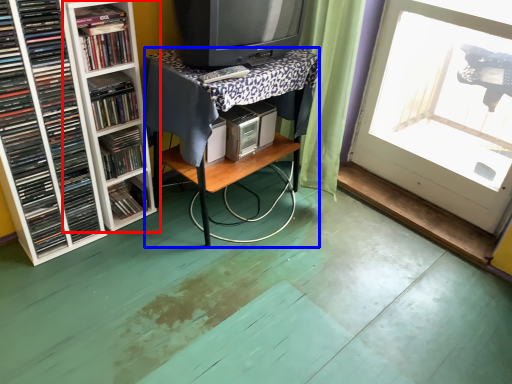
Question: Which point is closer to the camera, shelf (highlighted by a red box) or table (highlighted by a blue box)?

Choices:
 (A) shelf
 (B) table

Answer: (A)